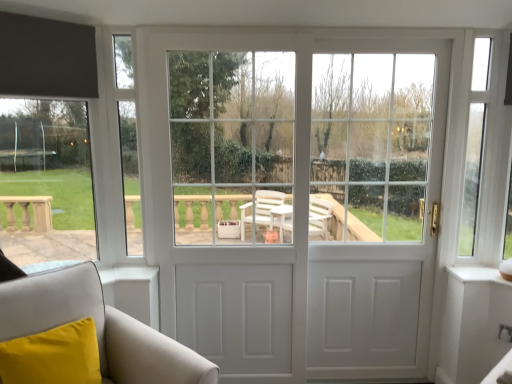
In order to click on free space above white matte door at center (from a real-world perspective) in this screenshot , I will do `click(300, 28)`.